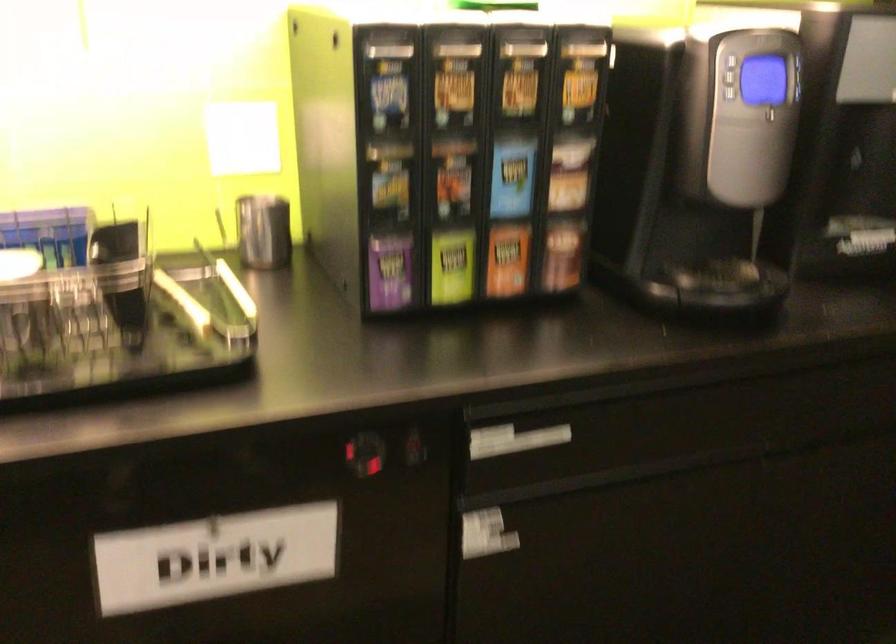
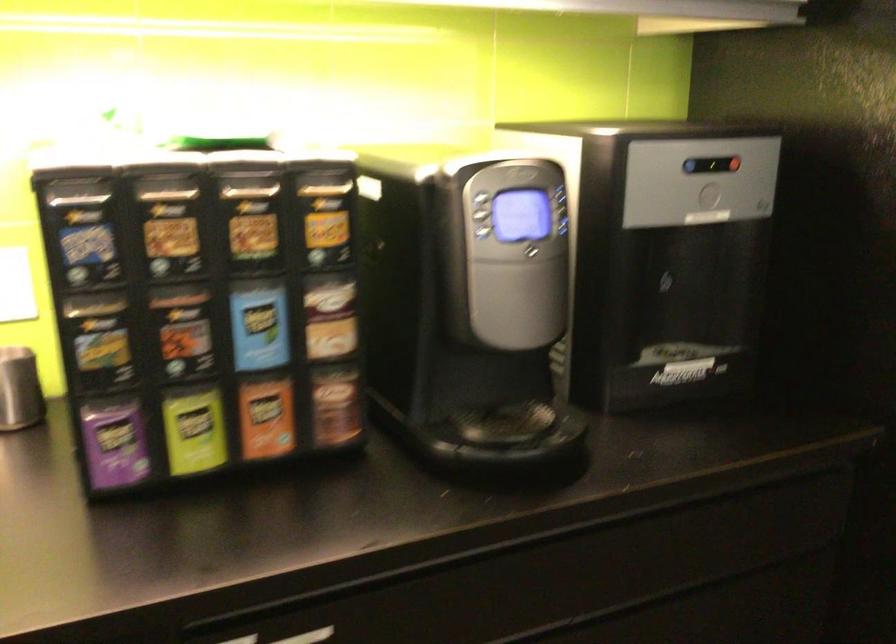
In the second image, find the point that corresponds to the point at 564,252 in the first image.

(336, 406)